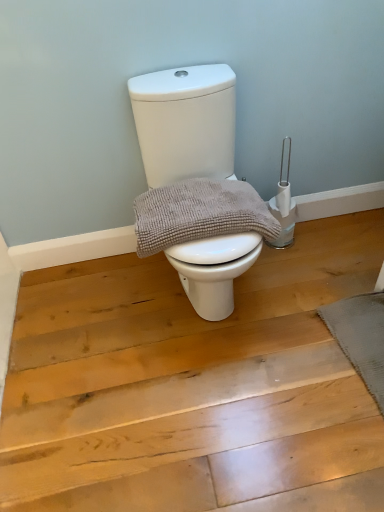
You are a GUI agent. You are given a task and a screenshot of the screen. Output one action in this format:
    pyautogui.click(x=<x>, y=<y>)
    Task: Click on the free space above gray textured towel at center (from a real-world perspective)
    
    Given the screenshot: What is the action you would take?
    pyautogui.click(x=195, y=208)